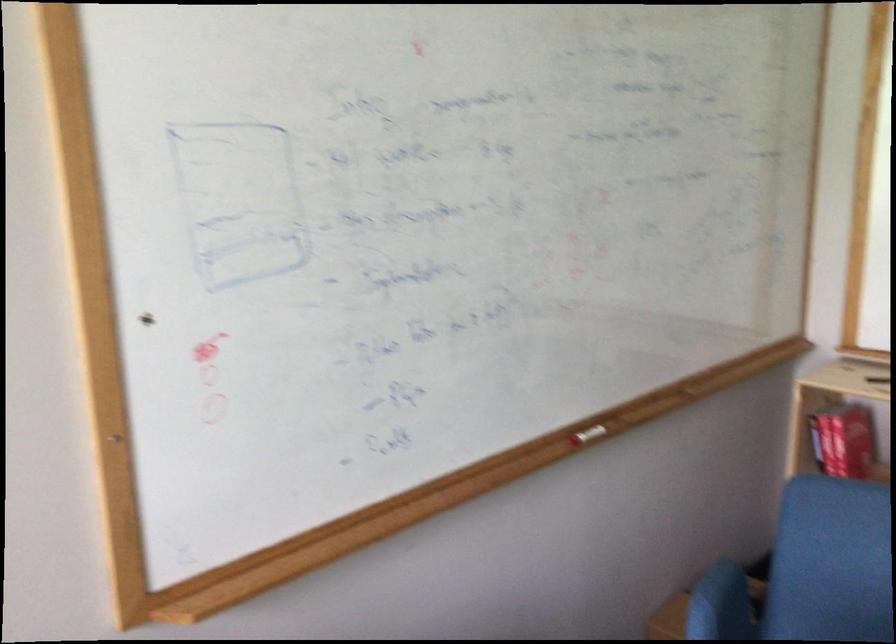
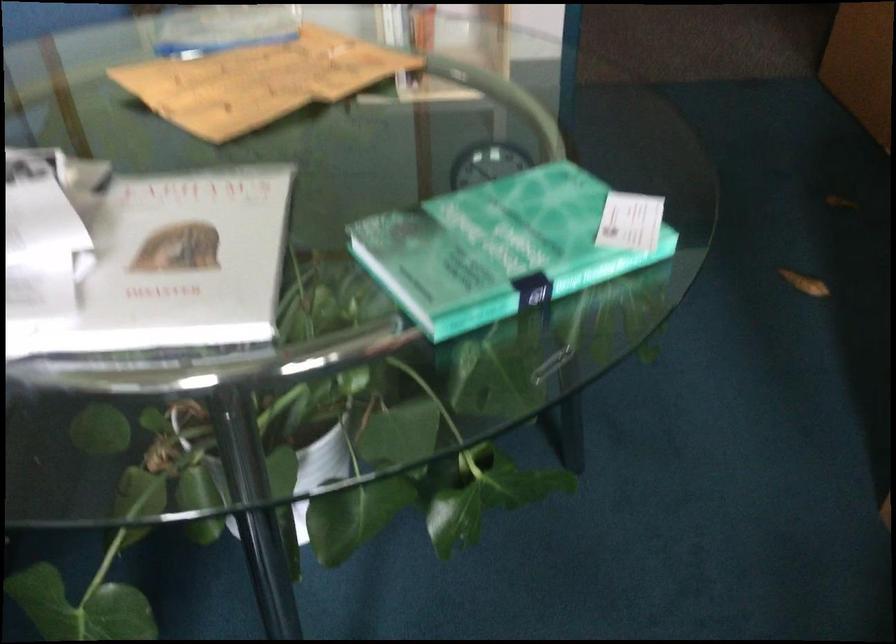
The images are taken continuously from a first-person perspective. In which direction is your viewpoint rotating?

The rotation direction of the camera is right-down.